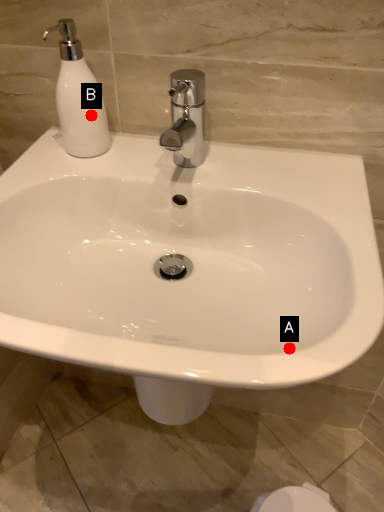
Question: Two points are circled on the image, labeled by A and B beside each circle. Which point is farther to the camera?

Choices:
 (A) A is further
 (B) B is further

Answer: (B)